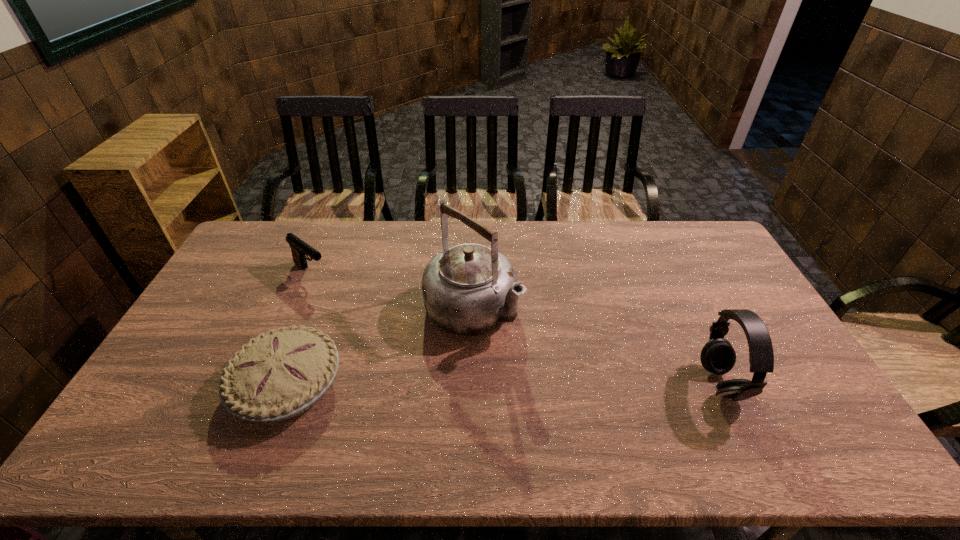
You are a GUI agent. You are given a task and a screenshot of the screen. Output one action in this format:
    pyautogui.click(x=<x>, y=<y>)
    Task: Click on the vacant space on the desktop that is between the pie and the earphone and is positioned at the barrel of the pistol
    The image size is (960, 540).
    Given the screenshot: What is the action you would take?
    [462, 384]

What are the coordinates of `vacant spot on the desktop that is between the shortest object and the second tallest object and is positioned at the spout of the third object from left to right` in the screenshot? It's located at (566, 383).